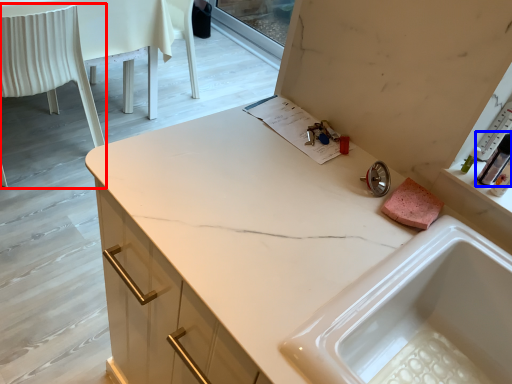
Question: Among these objects, which one is nearest to the camera, chair (highlighted by a red box) or toiletry (highlighted by a blue box)?

Choices:
 (A) chair
 (B) toiletry

Answer: (B)